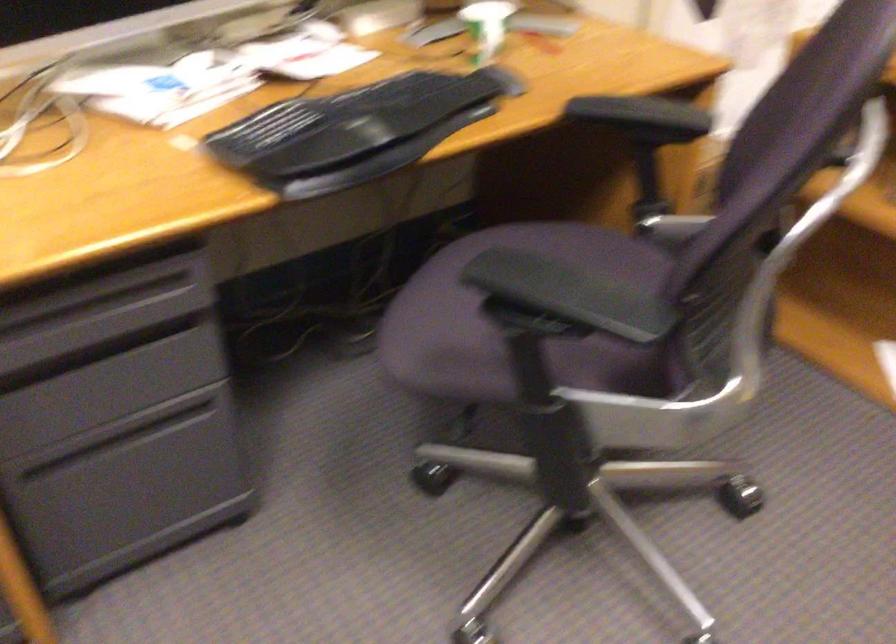
The image size is (896, 644). Identify the location of black chair armrest. (642, 116).